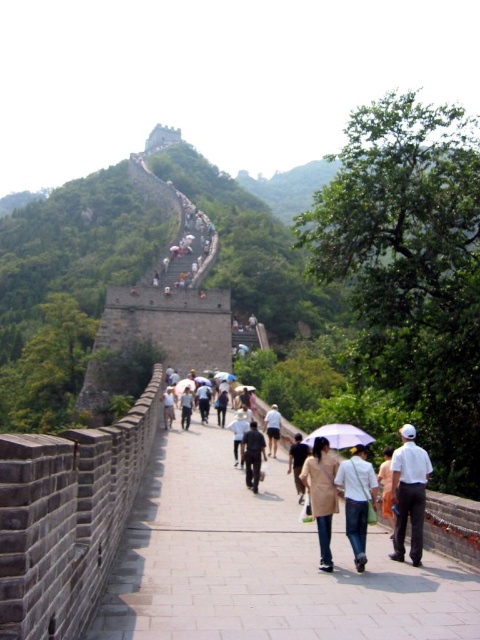
Is point (321, 563) in front of point (393, 506)?

That is True.

Who is shorter, beige fabric coat at center or white cotton shirt at center?

beige fabric coat at center

Is point (309, 483) less distant than point (393, 522)?

Yes, it is.

The width and height of the screenshot is (480, 640). I want to click on beige fabric coat at center, so click(322, 493).

Between point (249, 448) and point (290, 452), which one is positioned behind?

The point (290, 452) is more distant.

Where is `dark gray stone person at center`? The width and height of the screenshot is (480, 640). dark gray stone person at center is located at coordinates pyautogui.click(x=252, y=456).

Which is in front, point (259, 460) or point (303, 488)?

Positioned in front is point (303, 488).

Image resolution: width=480 pixels, height=640 pixels. What are the coordinates of `dark gray stone person at center` in the screenshot? It's located at (252, 456).

Does light beige coat at center have a greater width compared to white cotton shirt at center?

Indeed, light beige coat at center has a greater width compared to white cotton shirt at center.

Which is more to the right, light beige coat at center or white cotton shirt at center?

From the viewer's perspective, white cotton shirt at center appears more on the right side.

The image size is (480, 640). I want to click on light beige coat at center, so click(357, 499).